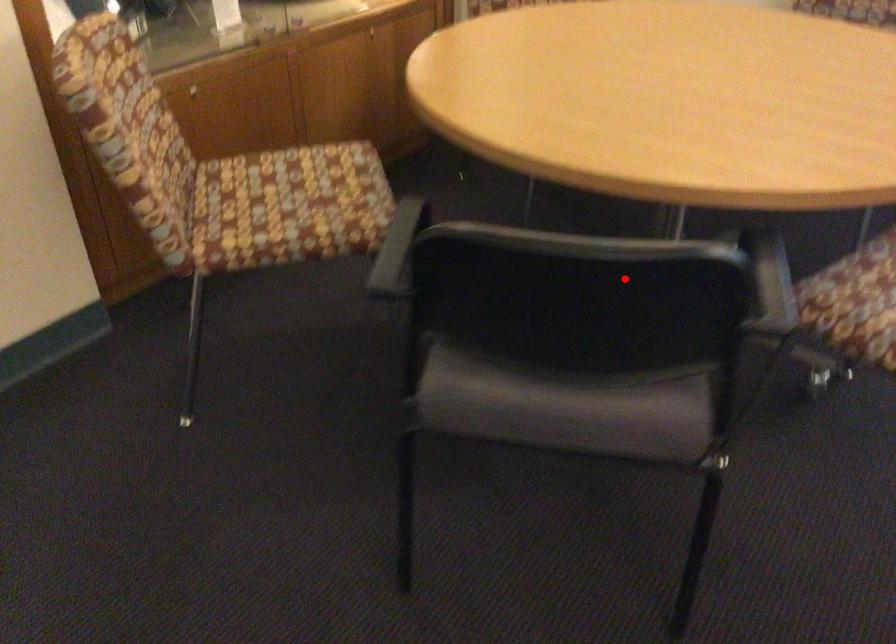
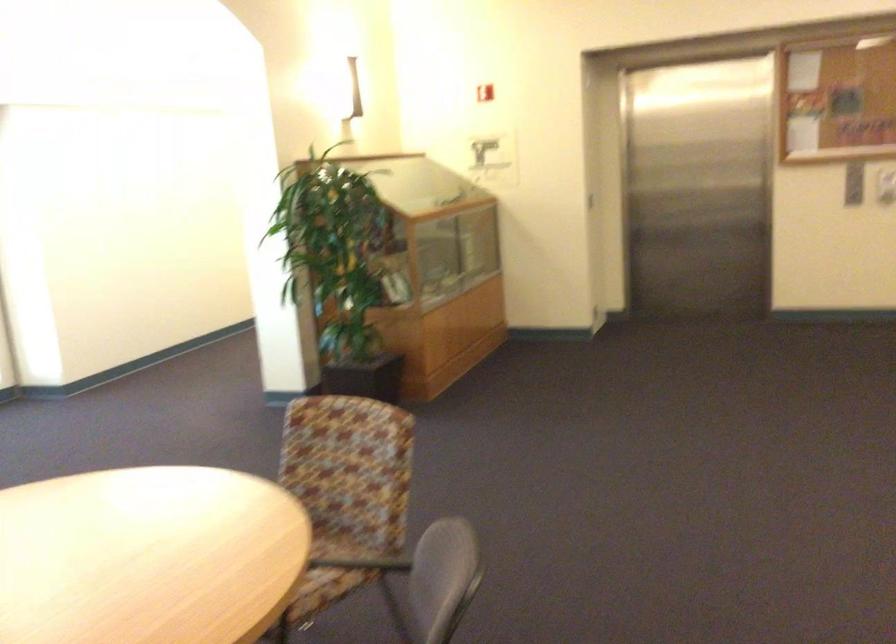
Question: A red point is marked in image1. In image2, is the corresponding 3D point closer to the camera or farther? Reply with the corresponding letter.

Choices:
 (A) The corresponding 3D point is closer.
 (B) The corresponding 3D point is farther.

Answer: (B)